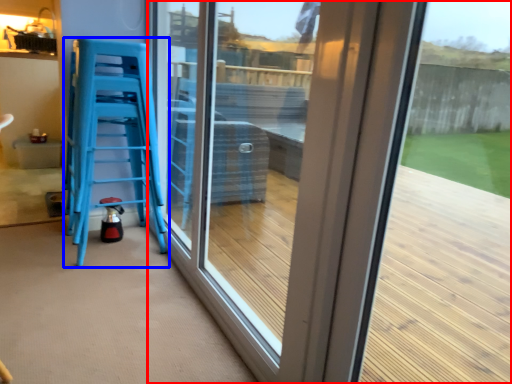
Question: Which point is closer to the camera, window (highlighted by a red box) or furniture (highlighted by a blue box)?

Choices:
 (A) window
 (B) furniture

Answer: (A)